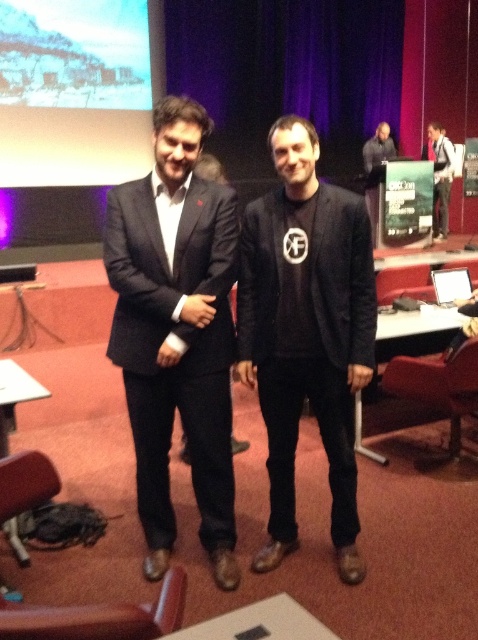
Does black matte jacket at center appear on the left side of matte black suit at center?

In fact, black matte jacket at center is to the right of matte black suit at center.

Can you confirm if black matte jacket at center is smaller than matte black suit at center?

No.

Describe the element at coordinates (306, 332) in the screenshot. I see `black matte jacket at center` at that location.

Locate an element on the screen. This screenshot has height=640, width=478. black matte jacket at center is located at coordinates (306, 332).

Is matte white screen at upper left bigger than dark gray suit at right?

Yes.

Is matte white screen at upper left to the left of dark gray suit at right from the viewer's perspective?

Yes, matte white screen at upper left is to the left of dark gray suit at right.

The width and height of the screenshot is (478, 640). Find the location of `matte white screen at upper left`. matte white screen at upper left is located at coordinates coord(75,52).

Who is positioned more to the right, black matte suit at center or dark gray hoodie at upper right?

dark gray hoodie at upper right

I want to click on black matte suit at center, so click(x=175, y=332).